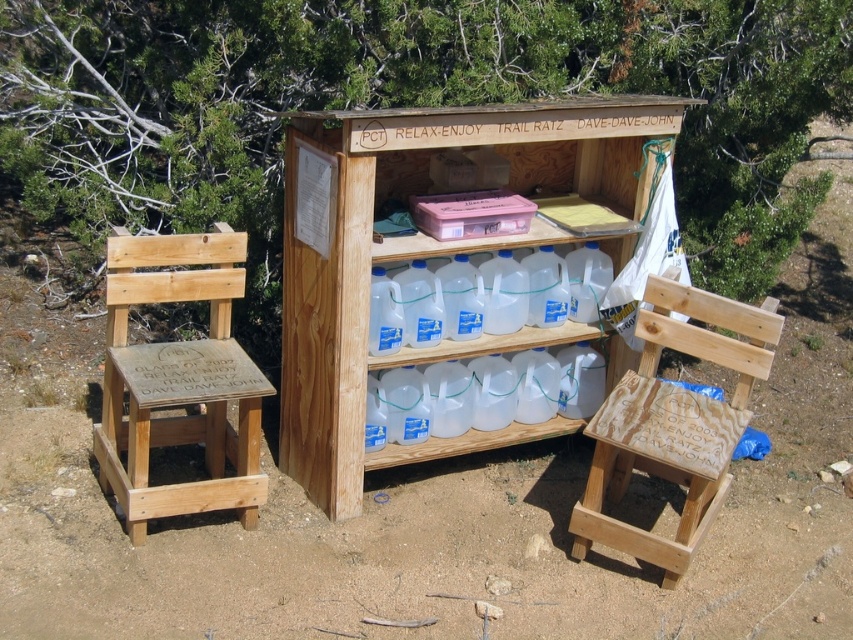
Describe the element at coordinates (428, 252) in the screenshot. I see `wooden at center` at that location.

I want to click on wooden at center, so click(x=428, y=252).

Which is behind, point (247, 403) or point (706, 529)?

The point (706, 529) is more distant.

Is natural wood step stool at left to the right of wooden step stool at lower right from the viewer's perspective?

Incorrect, natural wood step stool at left is not on the right side of wooden step stool at lower right.

I want to click on natural wood step stool at left, so click(x=178, y=380).

Can you confirm if wooden at center is positioned above wooden step stool at lower right?

Correct, wooden at center is located above wooden step stool at lower right.

Does point (554, 116) lie in front of point (712, 516)?

No, (554, 116) is further to viewer.

In order to click on wooden at center in this screenshot , I will do `click(428, 252)`.